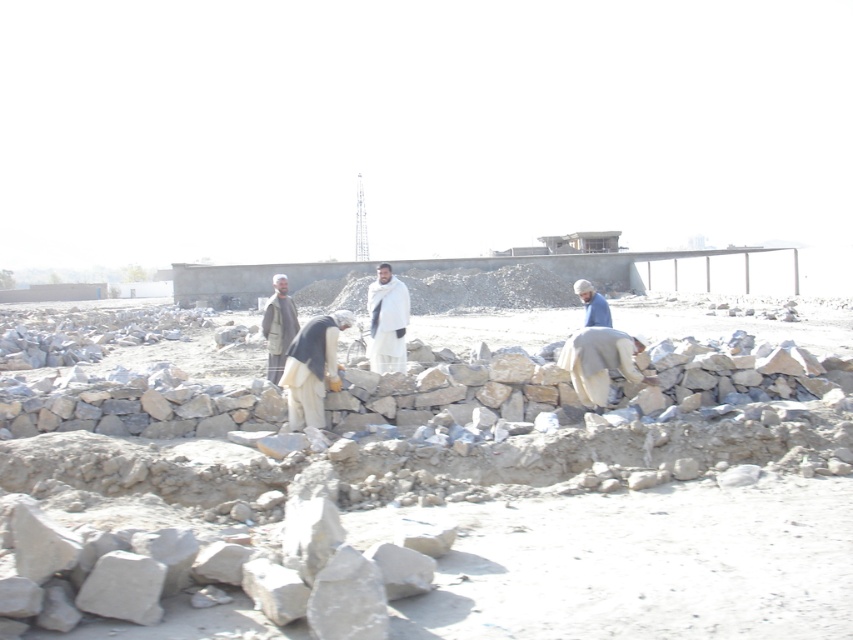
You are a safety inspector at the construction site. You notice the gray stone wall at center and the dark gray fabric construction worker at center. Which object is bigger in size?

The gray stone wall at center is larger in size than the dark gray fabric construction worker at center.

You are a construction worker trying to locate your missing items. You remember leaving a white woolen shawl at center and a light brown fabric jacket at center near each other on the construction site. Based on the scene description, can you determine if they are close enough to be easily retrieved together?

The white woolen shawl at center and light brown fabric jacket at center are 4.83 feet apart, so they are close enough to be easily retrieved together.

You are a safety inspector visiting the construction site. You need to ensure that the gray stone wall at center is stable enough to support the blue fabric construction worker at right who is working on it. Based on their sizes, is the wall likely to be stable?

The gray stone wall at center has a smaller size compared to blue fabric construction worker at right, so it may not be stable enough to support the worker. The inspector should recommend reinforcing the wall before allowing work to continue.